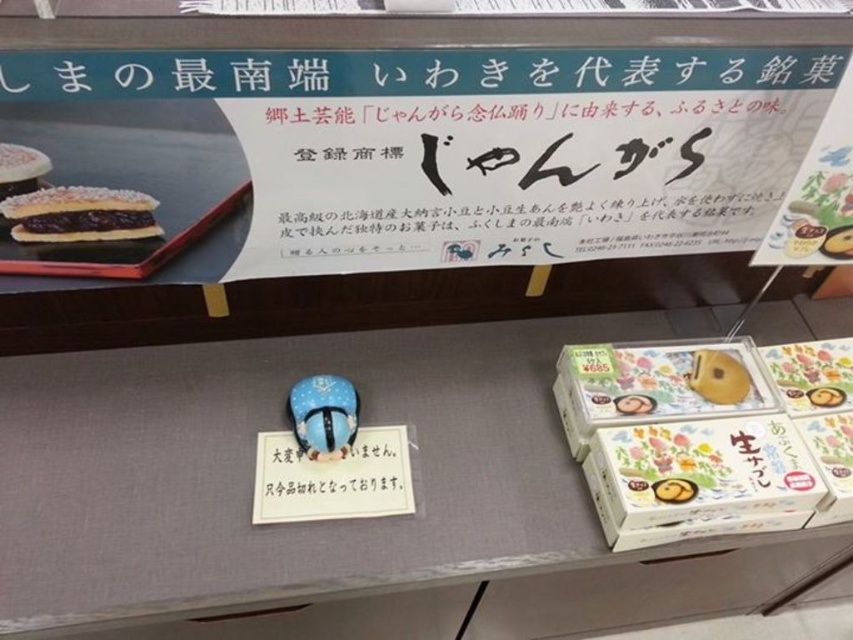
Is gray fabric table at center behind matte chocolate cake at upper left?

Yes, it is behind matte chocolate cake at upper left.

Does gray fabric table at center have a greater height compared to matte chocolate cake at upper left?

Correct, gray fabric table at center is much taller as matte chocolate cake at upper left.

The image size is (853, 640). What do you see at coordinates (253, 470) in the screenshot?
I see `gray fabric table at center` at bounding box center [253, 470].

Find the location of `gray fabric table at center`. gray fabric table at center is located at coordinates (253, 470).

Is golden matte cookie at center thinner than matte black cake at upper left?

No.

This screenshot has height=640, width=853. I want to click on golden matte cookie at center, so click(718, 376).

Locate an element on the screen. This screenshot has height=640, width=853. golden matte cookie at center is located at coordinates (718, 376).

Is gray fabric table at center below matte black cake at upper left?

Yes.

The image size is (853, 640). What do you see at coordinates (253, 470) in the screenshot?
I see `gray fabric table at center` at bounding box center [253, 470].

In order to click on gray fabric table at center in this screenshot , I will do `click(253, 470)`.